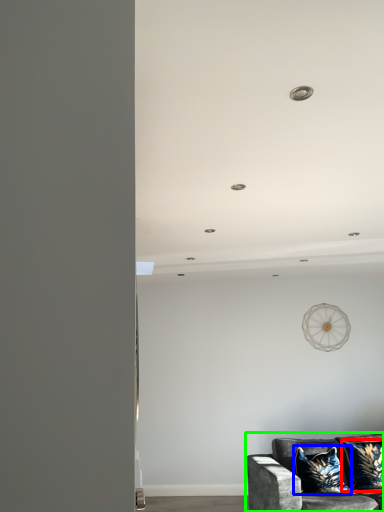
Question: Estimate the real-world distances between objects in this image. Which object is farther from pillow (highlighted by a red box), pillow (highlighted by a blue box) or studio couch (highlighted by a green box)?

Choices:
 (A) pillow
 (B) studio couch

Answer: (B)